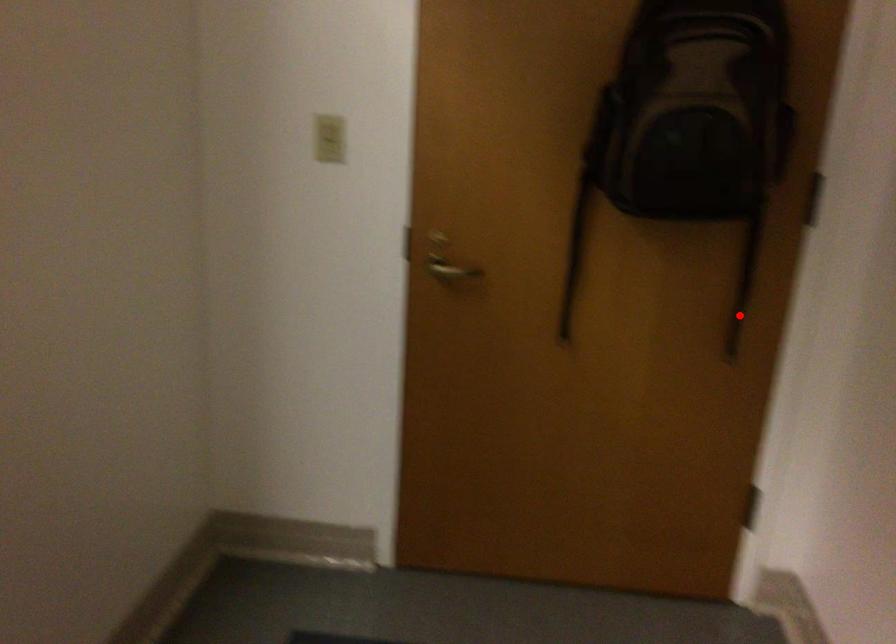
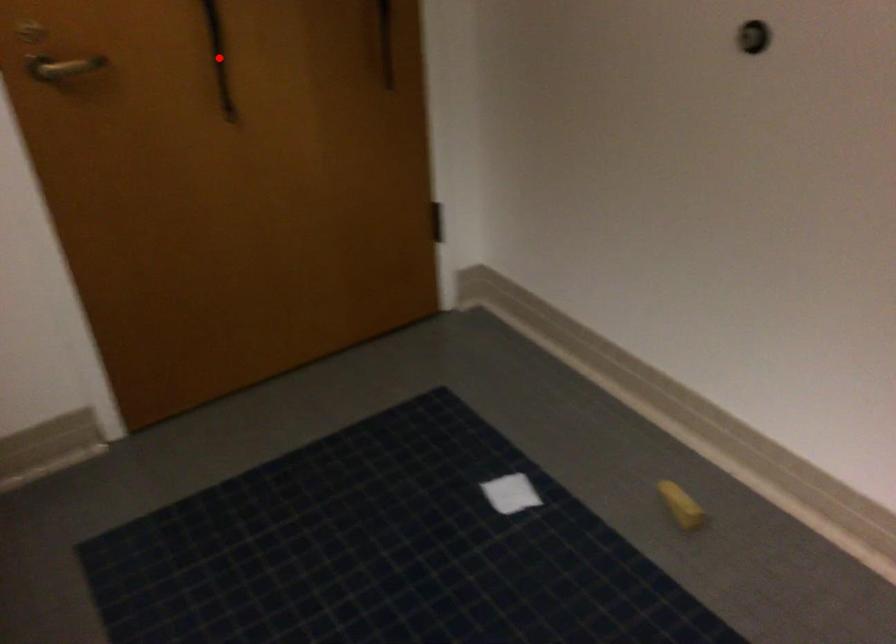
I am providing you with two images of the same scene from different viewpoints. A red point is marked on the first image and another point is marked on the second image. Are the points marked in image1 and image2 representing the same 3D position?

No